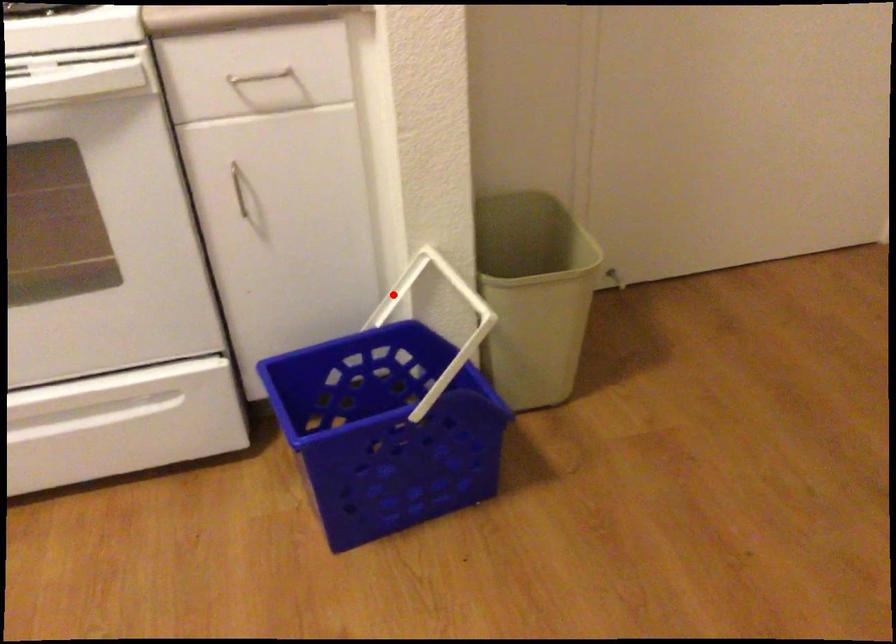
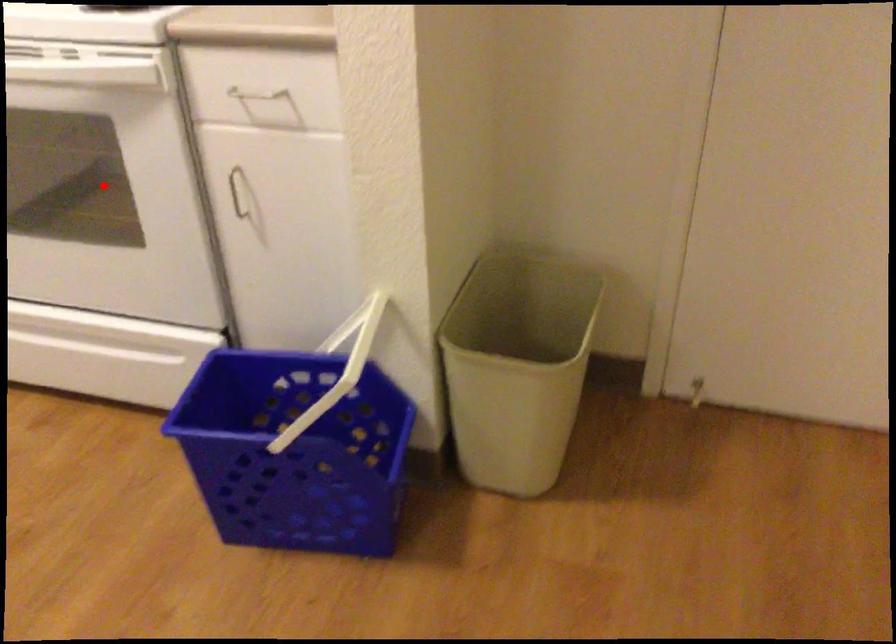
I am providing you with two images of the same scene from different viewpoints. A red point is marked on the first image and another point is marked on the second image. Do the highlighted points in image1 and image2 indicate the same real-world spot?

No